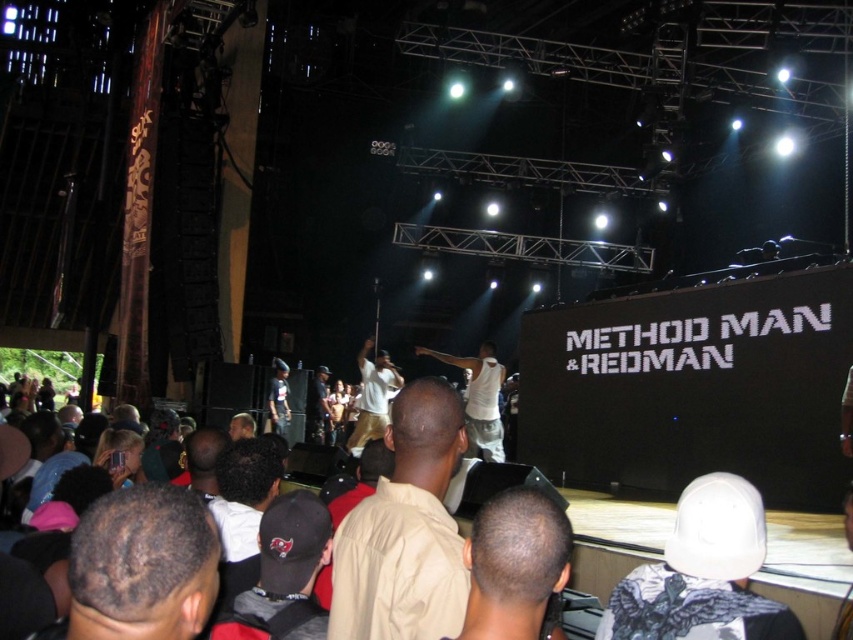
Consider the image. Who is taller, dark brown hair at center or black fabric cap at center?

With more height is black fabric cap at center.

Who is more distant from viewer, (543, 552) or (273, 531)?

Point (273, 531)

Image resolution: width=853 pixels, height=640 pixels. I want to click on dark brown hair at center, so click(514, 564).

Who is higher up, tan cotton shirt at center or white matte shirt at center?

tan cotton shirt at center is above.

Can you confirm if tan cotton shirt at center is wider than white matte shirt at center?

No, tan cotton shirt at center is not wider than white matte shirt at center.

Where is `tan cotton shirt at center`? Image resolution: width=853 pixels, height=640 pixels. tan cotton shirt at center is located at coordinates [x=405, y=531].

Between point (398, 580) and point (97, 579), which one is positioned behind?

Positioned behind is point (398, 580).

Between point (415, 474) and point (198, 577), which one is positioned in front?

Point (198, 577)

I want to click on tan cotton shirt at center, so click(405, 531).

In order to click on tan cotton shirt at center in this screenshot , I will do `click(405, 531)`.